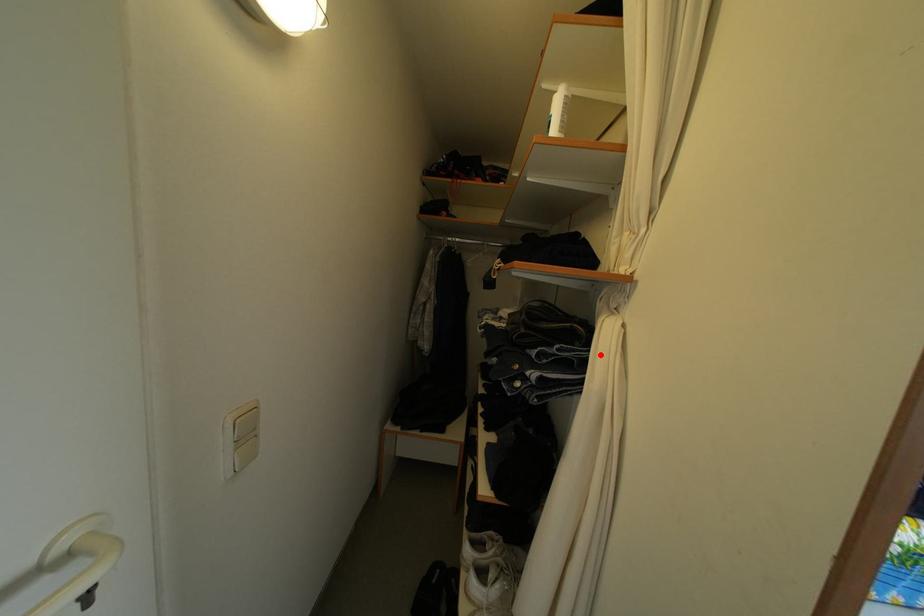
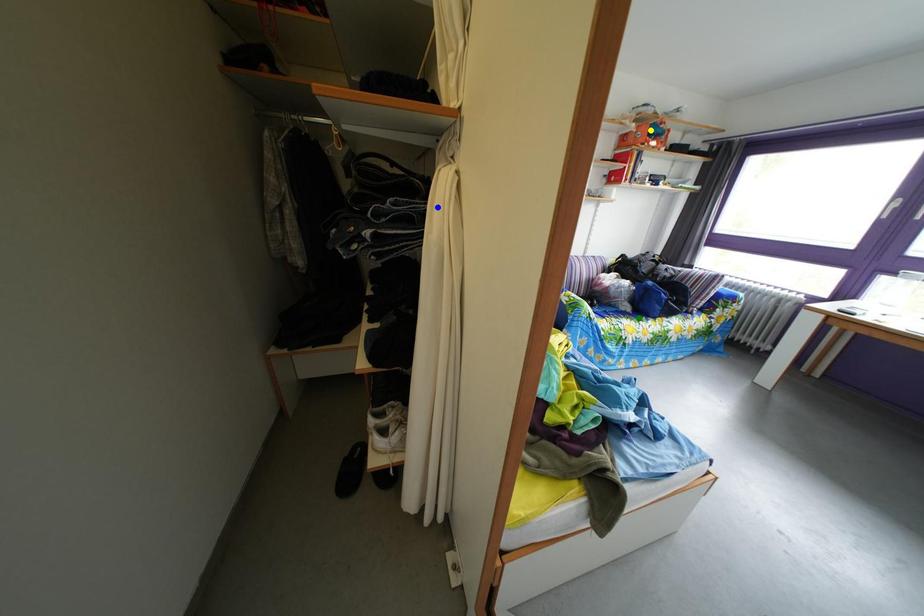
Question: I am providing you with two images of the same scene from different viewpoints. A red point is marked on the first image. You are given multiple points on the second image. Can you choose the point in image 2 that corresponds to the point in image 1?

Choices:
 (A) blue point
 (B) green point
 (C) yellow point

Answer: (A)